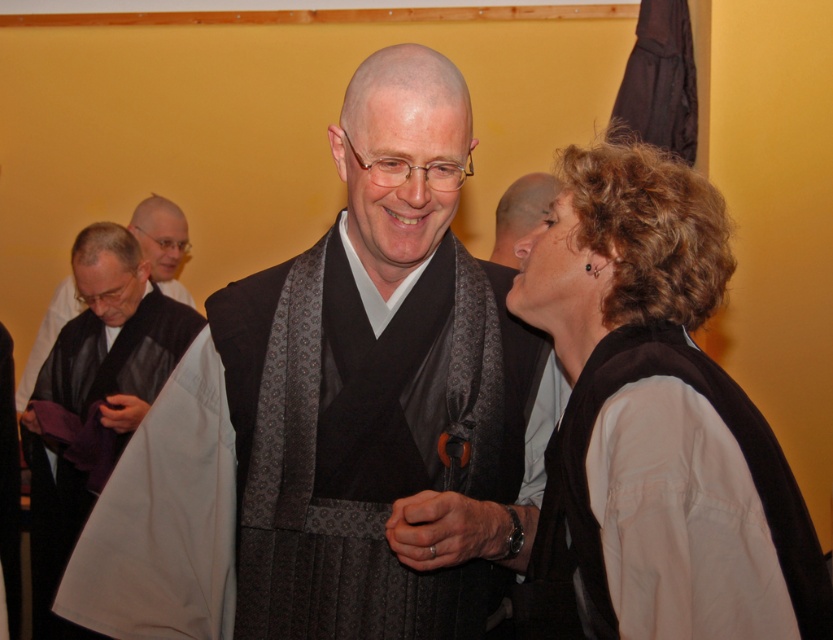
Question: Estimate the real-world distances between objects in this image. Which object is closer to the matte brown vest at right?

Choices:
 (A) black silk kimono at center
 (B) gray matte head at upper center
 (C) black silk robe at lower left

Answer: (A)

Question: Is black silk kimono at center to the right of matte brown vest at right from the viewer's perspective?

Choices:
 (A) yes
 (B) no

Answer: (B)

Question: From the image, what is the correct spatial relationship of black silk kimono at center in relation to black matte vest at left?

Choices:
 (A) below
 (B) above

Answer: (A)

Question: In this image, where is matte brown vest at right located relative to black silk robe at lower left?

Choices:
 (A) left
 (B) right

Answer: (B)

Question: Which object is the closest to the black matte vest at left?

Choices:
 (A) black silk kimono at center
 (B) matte brown vest at right
 (C) gray matte head at upper center
 (D) black silk robe at lower left

Answer: (D)

Question: Which object appears closest to the camera in this image?

Choices:
 (A) matte brown vest at right
 (B) black silk kimono at center
 (C) black silk robe at lower left
 (D) gray matte head at upper center

Answer: (A)